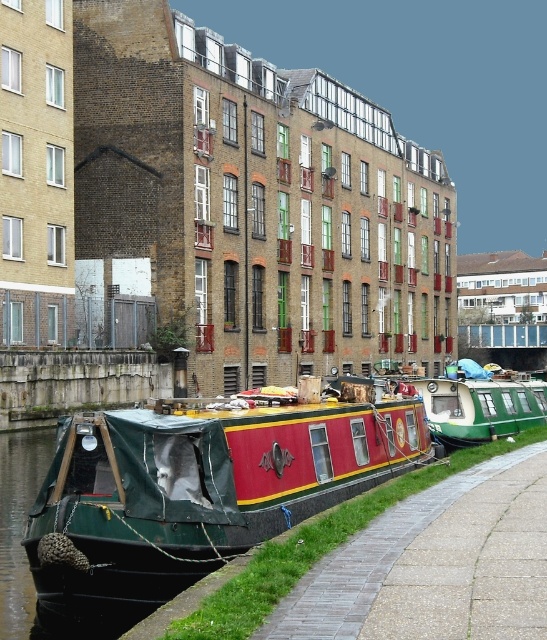
Which is below, green painted wooden barge at lower left or paved concrete path at lower right?

paved concrete path at lower right

Is green painted wooden barge at lower left closer to camera compared to paved concrete path at lower right?

No, green painted wooden barge at lower left is behind paved concrete path at lower right.

I want to click on green painted wooden barge at lower left, so click(x=202, y=486).